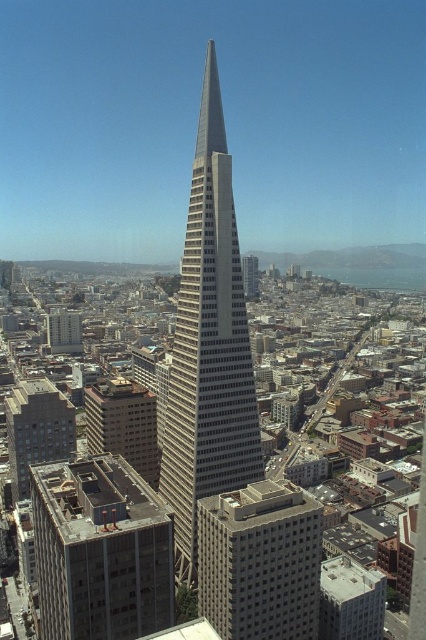
In the scene shown: You are a city planner analyzing the layout of the city. You notice the gray concrete building at lower left and the brown concrete building at lower left. Which of these two buildings has a greater width?

The gray concrete building at lower left has a greater width than the brown concrete building at lower left according to the description.

You are a city planner who needs to install a new 200 feet long public walkway between the white concrete building at center and the brown concrete building at lower left. Based on the scene description, will the walkway fit between them?

The distance between the white concrete building at center and the brown concrete building at lower left is 241.69 feet, which is longer than the 200 feet required for the walkway. Therefore, the walkway will fit between them.